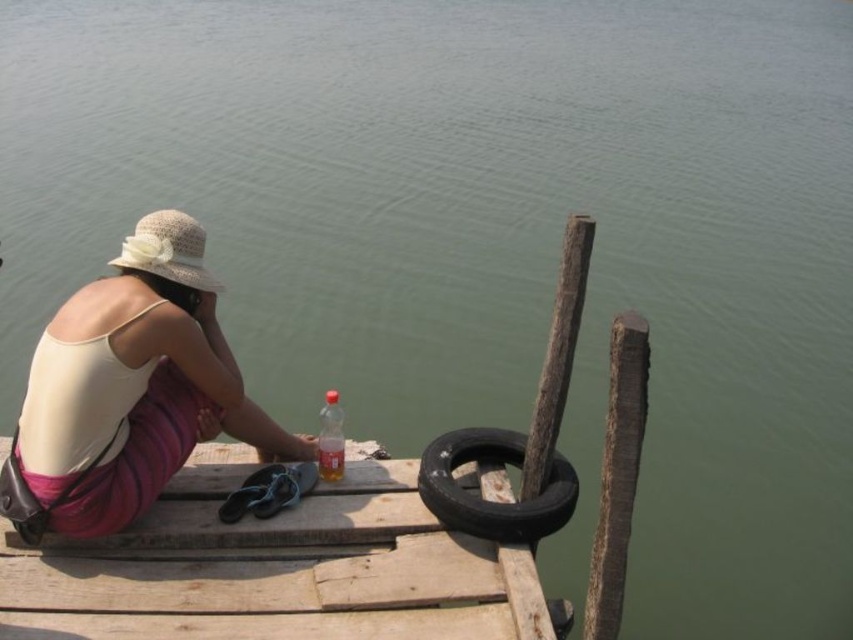
Question: Is white woven hat at upper left below translucent plastic bottle at lower center?

Choices:
 (A) no
 (B) yes

Answer: (A)

Question: Which of the following is the closest to the observer?

Choices:
 (A) wooden dock at center
 (B) translucent plastic bottle at lower center
 (C) white woven hat at upper left

Answer: (A)

Question: Does wooden dock at center appear over translucent plastic bottle at lower center?

Choices:
 (A) no
 (B) yes

Answer: (A)

Question: Where is wooden dock at center located in relation to white woven hat at upper left in the image?

Choices:
 (A) above
 (B) below

Answer: (B)

Question: Which of the following is the farthest from the observer?

Choices:
 (A) translucent plastic bottle at lower center
 (B) white woven hat at upper left
 (C) wooden dock at center

Answer: (A)

Question: Which is farther from the black rubber tire at lower center?

Choices:
 (A) translucent plastic bottle at lower center
 (B) white woven hat at upper left

Answer: (B)